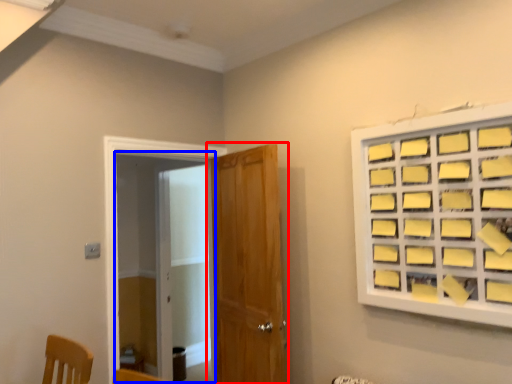
Question: Which point is closer to the camera, door (highlighted by a red box) or screen door (highlighted by a blue box)?

Choices:
 (A) door
 (B) screen door

Answer: (A)